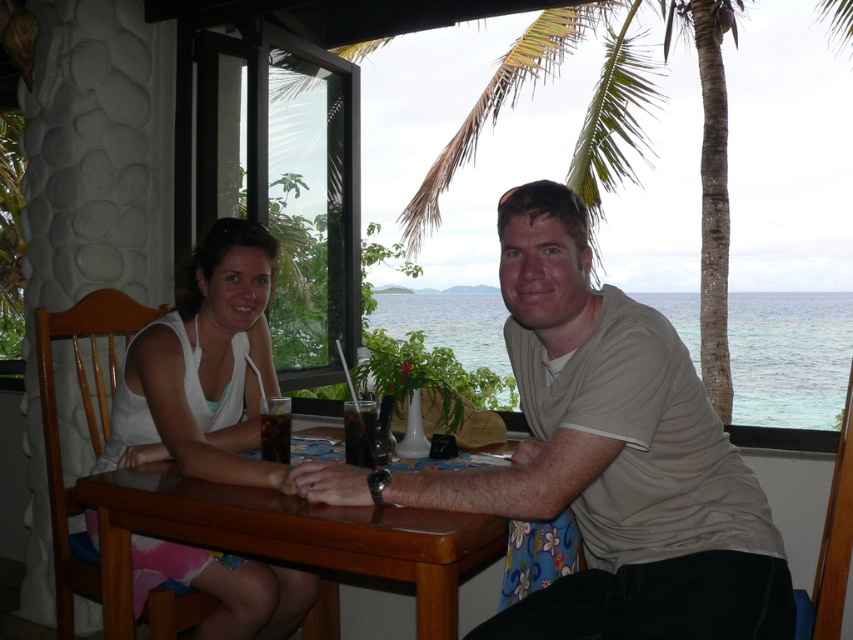
Is translucent glass drink at table center to the right of translucent glass cup at table center from the viewer's perspective?

Yes, translucent glass drink at table center is to the right of translucent glass cup at table center.

Which is below, translucent glass drink at table center or translucent glass cup at table center?

translucent glass drink at table center is lower down.

This screenshot has height=640, width=853. Describe the element at coordinates (358, 433) in the screenshot. I see `translucent glass drink at table center` at that location.

In order to click on translucent glass drink at table center in this screenshot , I will do `click(358, 433)`.

Who is shorter, white fabric dress at center or translucent glass drink at table center?

With less height is translucent glass drink at table center.

Who is higher up, white fabric dress at center or translucent glass drink at table center?

translucent glass drink at table center is higher up.

Is point (136, 396) less distant than point (350, 428)?

No.

Locate an element on the screen. white fabric dress at center is located at coordinates (202, 368).

Is brown polished wood table at center behind translucent glass drink at table center?

No.

Locate an element on the screen. This screenshot has width=853, height=640. brown polished wood table at center is located at coordinates (309, 550).

Where is `brown polished wood table at center`? brown polished wood table at center is located at coordinates (309, 550).

Where is `brown polished wood table at center`? brown polished wood table at center is located at coordinates (309, 550).